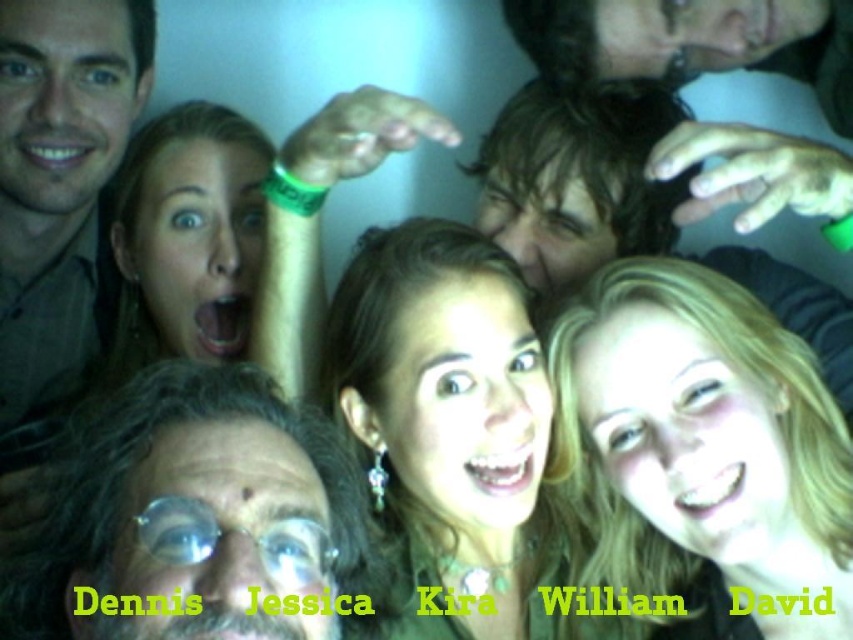
Does point (399, 432) lie behind point (38, 259)?

No.

Who is higher up, shiny gold necklace at center or matte brown shirt at left?

matte brown shirt at left is above.

Locate an element on the screen. This screenshot has width=853, height=640. shiny gold necklace at center is located at coordinates (457, 426).

Can you confirm if curly hair man at center is positioned below matte brown shirt at left?

Indeed, curly hair man at center is positioned under matte brown shirt at left.

Is point (183, 394) more distant than point (88, 6)?

No.

Does point (184, 595) come farther from viewer compared to point (10, 308)?

No, it is in front of (10, 308).

What are the coordinates of `curly hair man at center` in the screenshot? It's located at (192, 516).

From the picture: Is blonde hair at center positioned in front of shiny gold necklace at center?

Yes.

Is blonde hair at center to the right of shiny gold necklace at center from the viewer's perspective?

Correct, you'll find blonde hair at center to the right of shiny gold necklace at center.

You are a GUI agent. You are given a task and a screenshot of the screen. Output one action in this format:
    pyautogui.click(x=<x>, y=<y>)
    Task: Click on the blonde hair at center
    The width and height of the screenshot is (853, 640).
    Given the screenshot: What is the action you would take?
    pyautogui.click(x=700, y=448)

Locate an element on the screen. blonde hair at center is located at coordinates (700, 448).